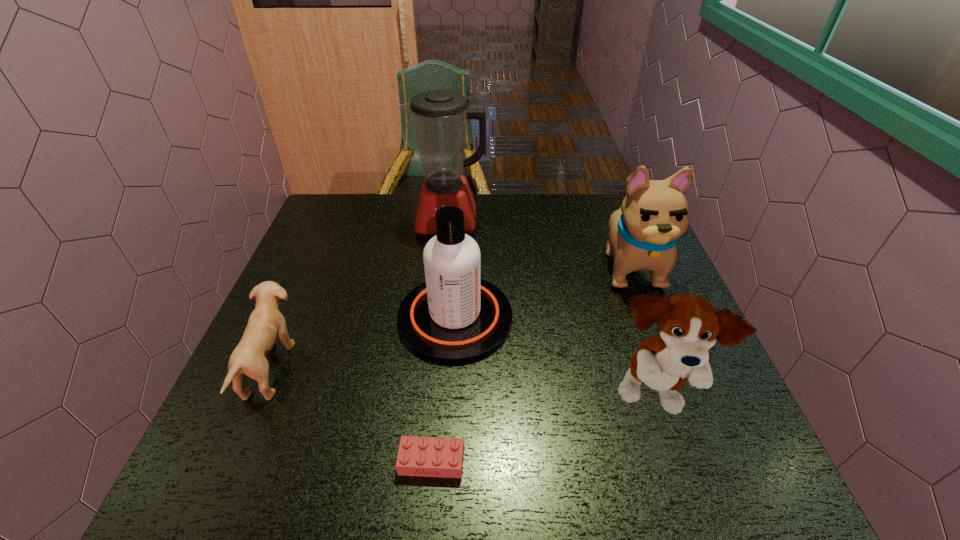
This screenshot has width=960, height=540. I want to click on free space located 0.070m on the left side of the fifth tallest object, so click(321, 368).

You are a GUI agent. You are given a task and a screenshot of the screen. Output one action in this format:
    pyautogui.click(x=<x>, y=<y>)
    Task: Click on the blank area located on the back of the Lego
    This screenshot has height=540, width=960.
    Given the screenshot: What is the action you would take?
    pyautogui.click(x=445, y=300)

Locate an element on the screen. Image resolution: width=960 pixels, height=540 pixels. blender that is at the far edge is located at coordinates (439, 117).

Find the location of a particular element. puppy positioned at the far edge is located at coordinates (643, 233).

Where is `object that is at the near edge`? The image size is (960, 540). object that is at the near edge is located at coordinates (417, 456).

Locate an element on the screen. object located at the left edge is located at coordinates (266, 322).

The width and height of the screenshot is (960, 540). Identify the location of object at the far right corner. (643, 233).

Locate an element on the screen. vacant space at the near edge is located at coordinates (536, 474).

The image size is (960, 540). Find the location of `vacant area at the left edge`. vacant area at the left edge is located at coordinates (255, 393).

This screenshot has width=960, height=540. Find the location of `vacant point at the right edge`. vacant point at the right edge is located at coordinates (603, 243).